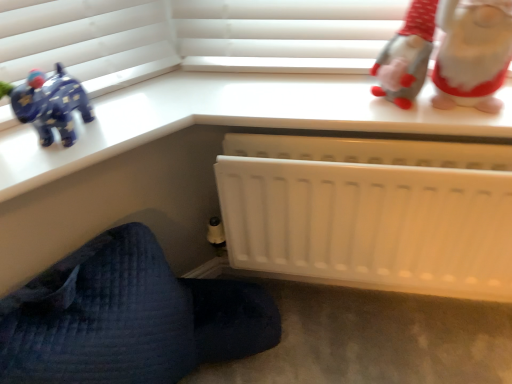
Question: Does white matte radiator at lower right have a lesser height compared to white plush gnome at upper right?

Choices:
 (A) yes
 (B) no

Answer: (B)

Question: Is white matte radiator at lower right behind white plush gnome at upper right?

Choices:
 (A) yes
 (B) no

Answer: (B)

Question: Is white matte radiator at lower right oriented towards white plush gnome at upper right?

Choices:
 (A) yes
 (B) no

Answer: (B)

Question: Considering the relative sizes of white matte radiator at lower right and white plush gnome at upper right in the image provided, is white matte radiator at lower right wider than white plush gnome at upper right?

Choices:
 (A) yes
 (B) no

Answer: (A)

Question: From a real-world perspective, is white matte radiator at lower right located higher than white plush gnome at upper right?

Choices:
 (A) no
 (B) yes

Answer: (A)

Question: Considering the positions of white plush gnome at upper right and white plastic radiator at lower center in the image, is white plush gnome at upper right wider or thinner than white plastic radiator at lower center?

Choices:
 (A) wide
 (B) thin

Answer: (A)

Question: Is white plush gnome at upper right bigger or smaller than white plastic radiator at lower center?

Choices:
 (A) big
 (B) small

Answer: (B)

Question: From a real-world perspective, is white plush gnome at upper right positioned above or below white plastic radiator at lower center?

Choices:
 (A) below
 (B) above

Answer: (B)

Question: Considering the positions of white plush gnome at upper right and white plastic radiator at lower center in the image, is white plush gnome at upper right taller or shorter than white plastic radiator at lower center?

Choices:
 (A) tall
 (B) short

Answer: (B)

Question: From their relative heights in the image, would you say white plush gnome at upper right is taller or shorter than white matte radiator at lower right?

Choices:
 (A) short
 (B) tall

Answer: (A)

Question: Is point (464, 29) positioned closer to the camera than point (77, 264)?

Choices:
 (A) closer
 (B) farther

Answer: (A)

Question: Would you say white plush gnome at upper right is inside or outside white matte radiator at lower right?

Choices:
 (A) outside
 (B) inside

Answer: (A)

Question: From a real-world perspective, is white plush gnome at upper right positioned above or below white matte radiator at lower right?

Choices:
 (A) above
 (B) below

Answer: (A)

Question: In the image, is white plastic radiator at lower center on the left side or the right side of white plush gnome at upper right?

Choices:
 (A) right
 (B) left

Answer: (B)

Question: Is white plastic radiator at lower center taller or shorter than white plush gnome at upper right?

Choices:
 (A) short
 (B) tall

Answer: (B)